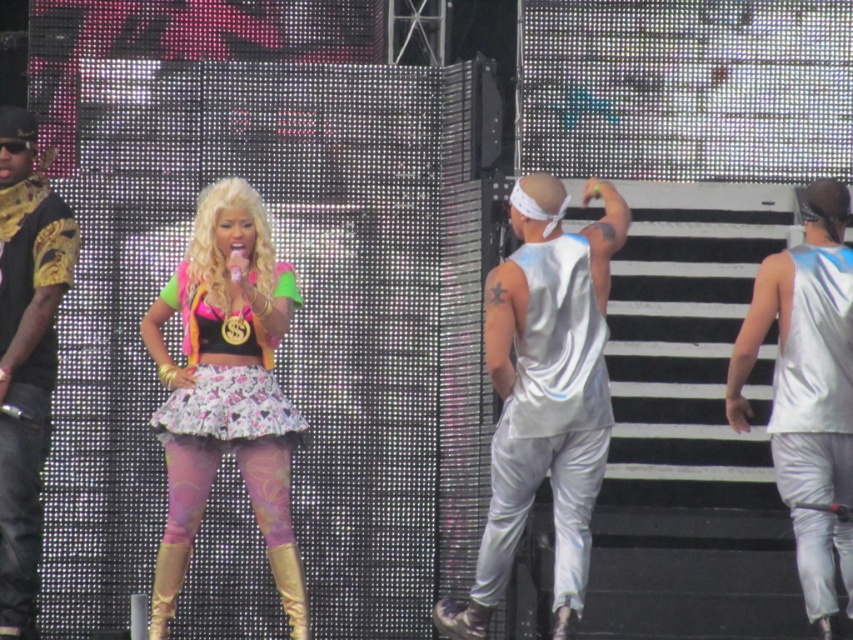
Question: Is shiny silver tank top at right positioned in front of shiny metallic skirt at center?

Choices:
 (A) no
 (B) yes

Answer: (A)

Question: Can you confirm if matte pink skirt at center is thinner than gold-patterned shirt at left?

Choices:
 (A) no
 (B) yes

Answer: (B)

Question: Which of the following is the closest to the observer?

Choices:
 (A) (735, 413)
 (B) (190, 412)
 (C) (592, 269)

Answer: (B)

Question: Is matte pink skirt at center further to the viewer compared to gold-patterned shirt at left?

Choices:
 (A) yes
 (B) no

Answer: (B)

Question: Which of the following is the farthest from the observer?

Choices:
 (A) (234, 337)
 (B) (537, 483)
 (C) (32, 634)
 (D) (817, 458)

Answer: (A)

Question: Which object is farther from the camera taking this photo?

Choices:
 (A) gold-patterned shirt at left
 (B) shiny silver tank top at right

Answer: (B)